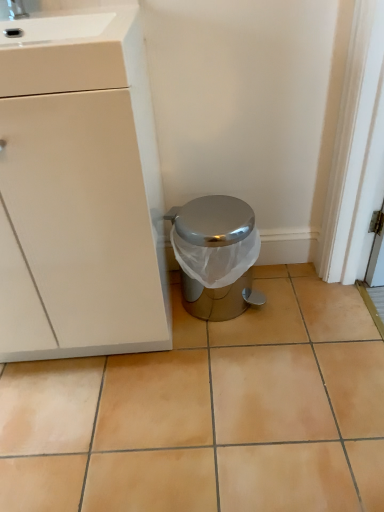
Question: Considering the relative positions of beige ceramic tile at center and white matte cabinet at left in the image provided, is beige ceramic tile at center in front of white matte cabinet at left?

Choices:
 (A) yes
 (B) no

Answer: (B)

Question: Considering the relative sizes of beige ceramic tile at center and white matte cabinet at left in the image provided, is beige ceramic tile at center shorter than white matte cabinet at left?

Choices:
 (A) yes
 (B) no

Answer: (A)

Question: Considering the relative sizes of beige ceramic tile at center and white matte cabinet at left in the image provided, is beige ceramic tile at center bigger than white matte cabinet at left?

Choices:
 (A) no
 (B) yes

Answer: (A)

Question: From a real-world perspective, does beige ceramic tile at center sit lower than white matte cabinet at left?

Choices:
 (A) no
 (B) yes

Answer: (B)

Question: Does beige ceramic tile at center have a greater width compared to white matte cabinet at left?

Choices:
 (A) yes
 (B) no

Answer: (A)

Question: Can white matte cabinet at left be found inside beige ceramic tile at center?

Choices:
 (A) no
 (B) yes

Answer: (A)

Question: Is shiny metallic trash can at center placed right next to beige ceramic tile at center?

Choices:
 (A) yes
 (B) no

Answer: (B)

Question: Is shiny metallic trash can at center positioned behind beige ceramic tile at center?

Choices:
 (A) no
 (B) yes

Answer: (B)

Question: Is beige ceramic tile at center at the back of shiny metallic trash can at center?

Choices:
 (A) no
 (B) yes

Answer: (A)

Question: Could you tell me if shiny metallic trash can at center is facing beige ceramic tile at center?

Choices:
 (A) yes
 (B) no

Answer: (A)

Question: Can you confirm if shiny metallic trash can at center is positioned to the right of beige ceramic tile at center?

Choices:
 (A) yes
 (B) no

Answer: (A)

Question: Considering the relative sizes of shiny metallic trash can at center and beige ceramic tile at center in the image provided, is shiny metallic trash can at center smaller than beige ceramic tile at center?

Choices:
 (A) no
 (B) yes

Answer: (B)

Question: Is shiny metallic trash can at center far away from white matte cabinet at left?

Choices:
 (A) no
 (B) yes

Answer: (A)